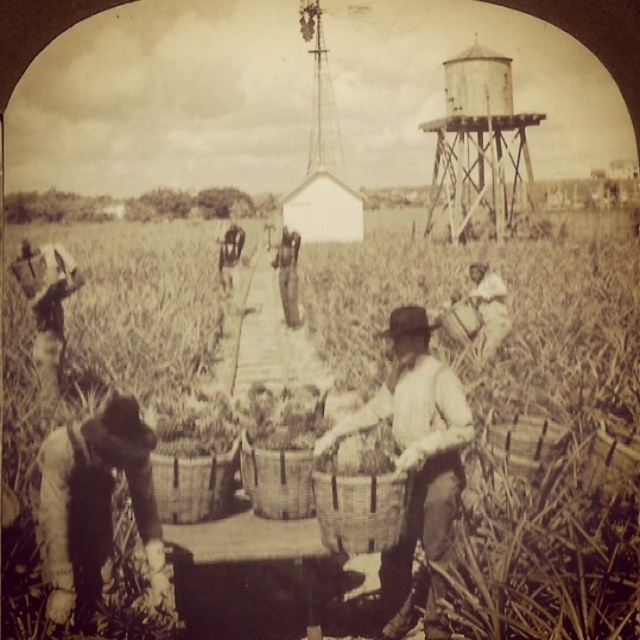
Question: Which is nearer to the woven basket at center?

Choices:
 (A) dark brown fabric at lower left
 (B) wooden water tower at upper right
 (C) woven baskets at center

Answer: (A)

Question: From the image, what is the correct spatial relationship of woven basket at center in relation to dark brown fabric at lower left?

Choices:
 (A) below
 (B) above

Answer: (B)

Question: Does dark brown fabric at lower left have a smaller size compared to wooden water tower at upper right?

Choices:
 (A) no
 (B) yes

Answer: (A)

Question: Which point is farther to the camera?

Choices:
 (A) dark brown fabric at lower left
 (B) wooden water tower at upper right

Answer: (B)

Question: Among these objects, which one is farthest from the camera?

Choices:
 (A) woven baskets at center
 (B) woven basket at center

Answer: (A)

Question: Can you confirm if woven basket at center is bigger than dark brown fabric at lower left?

Choices:
 (A) yes
 (B) no

Answer: (A)